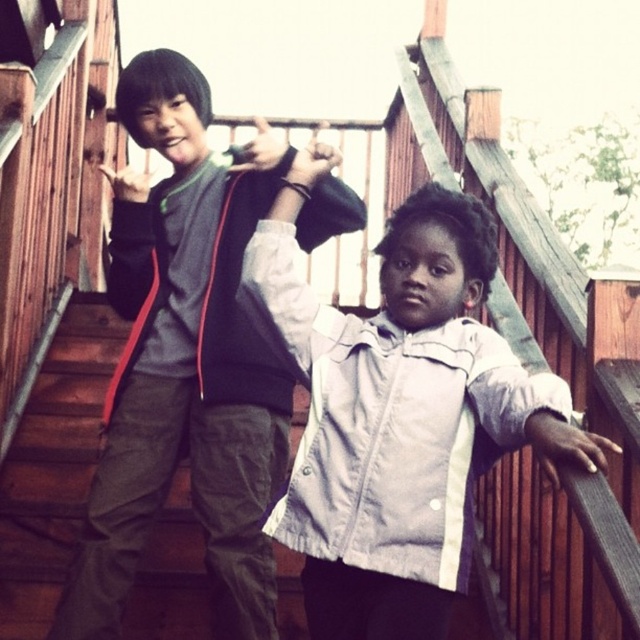
Question: Can you confirm if white matte jacket at center is thinner than dark gray fleece vest at center?

Choices:
 (A) no
 (B) yes

Answer: (B)

Question: Which object is farther from the camera taking this photo?

Choices:
 (A) white matte jacket at center
 (B) dark gray fleece vest at center

Answer: (B)

Question: Can you confirm if white matte jacket at center is wider than dark gray fleece vest at center?

Choices:
 (A) no
 (B) yes

Answer: (A)

Question: Is white matte jacket at center positioned in front of dark gray fleece vest at center?

Choices:
 (A) no
 (B) yes

Answer: (B)

Question: Which object is farther from the camera taking this photo?

Choices:
 (A) dark gray fleece vest at center
 (B) white matte jacket at center

Answer: (A)